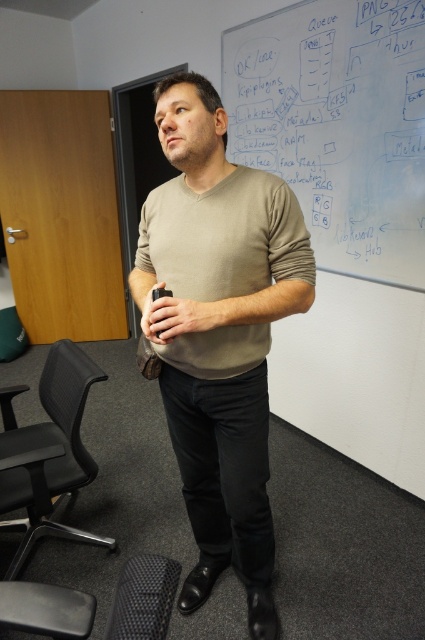
What are the coordinates of the beige cotton sweater at center?

The beige cotton sweater at center is located at coordinates point (x=221, y=333).

Based on the photo, you are a presenter standing in front of the white chalkboard at upper center and the matte black remote at center. Which object is closer to you?

The white chalkboard at upper center is closer to you because it is further to the viewer than the matte black remote at center, meaning it is positioned nearer in the visual perspective.